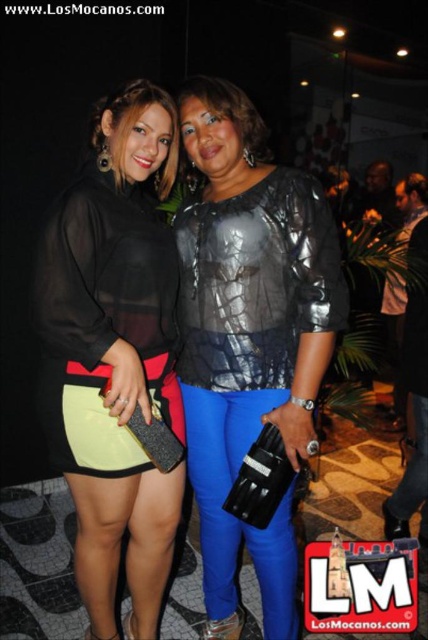
How much distance is there between metallic silver blouse at center and matte black dress at center?

metallic silver blouse at center is 9.74 inches away from matte black dress at center.

Who is lower down, metallic silver blouse at center or matte black dress at center?

matte black dress at center is below.

In order to click on metallic silver blouse at center in this screenshot , I will do `click(249, 337)`.